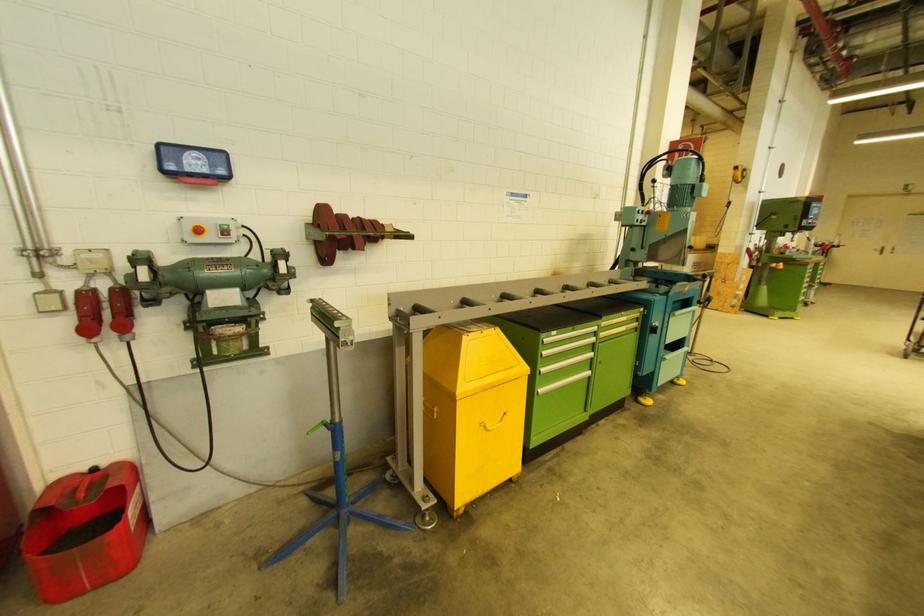
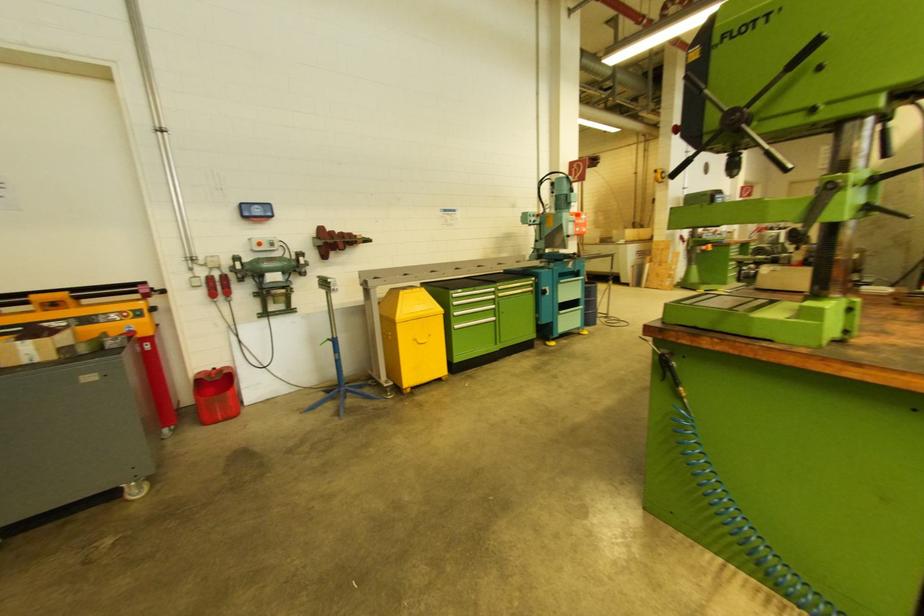
In the second image, find the point that corresponds to point (105, 286) in the first image.

(219, 276)